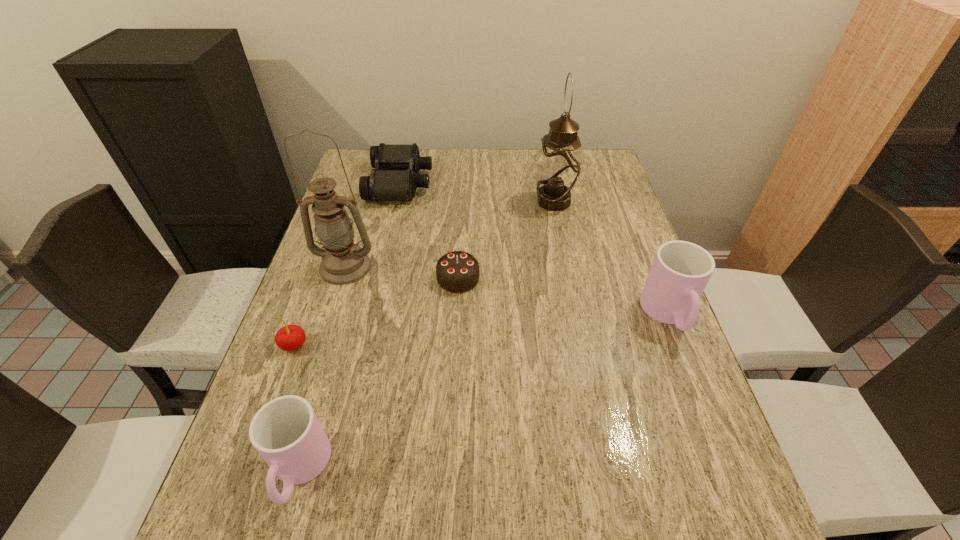
Locate an element on the screen. The width and height of the screenshot is (960, 540). vacant space positioned with the handle on the side of the third tallest object is located at coordinates (698, 389).

You are a GUI agent. You are given a task and a screenshot of the screen. Output one action in this format:
    pyautogui.click(x=<x>, y=<y>)
    Task: Click on the vacant position located 0.350m on the left of the farther oil lamp
    The height and width of the screenshot is (540, 960).
    Given the screenshot: What is the action you would take?
    pyautogui.click(x=421, y=202)

Find the location of a particular element. free space located 0.280m on the right of the third object from right to left is located at coordinates (588, 278).

Locate an element on the screen. The height and width of the screenshot is (540, 960). free region located through the eyepieces of the binoculars is located at coordinates (543, 183).

This screenshot has height=540, width=960. What are the coordinates of `vacant space located 0.370m on the right of the third shortest object` in the screenshot? It's located at (473, 345).

Identify the location of free region located 0.220m on the right of the nearer oil lamp. (460, 267).

At what (x,y) coordinates should I click in order to perform the action: click on object present at the far edge. Please return your answer as a coordinate pair (x, y). Looking at the image, I should click on (394, 178).

Where is `object situated at the near edge`? object situated at the near edge is located at coordinates (286, 432).

This screenshot has height=540, width=960. I want to click on cup that is at the left edge, so click(286, 432).

The width and height of the screenshot is (960, 540). I want to click on binoculars at the left edge, so click(394, 178).